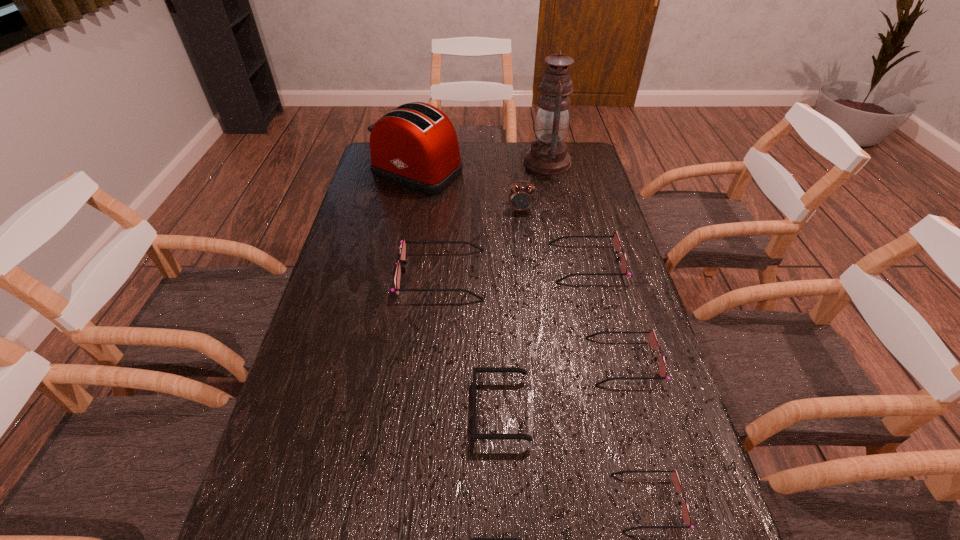
The height and width of the screenshot is (540, 960). I want to click on blank space located on the bridge of the fifth shortest sunglasses, so tap(529, 262).

Locate an element on the screen. This screenshot has height=540, width=960. free region located 0.390m on the bridge of the second nearest pink sunglasses is located at coordinates (430, 361).

Identify the location of vacant space positioned on the bridge of the second nearest pink sunglasses. The height and width of the screenshot is (540, 960). (529, 361).

Identify the location of vacant area situated on the bridge of the second nearest pink sunglasses. (504, 361).

I want to click on vacant space situated 0.100m on the front-facing side of the bigger black sunglasses, so 428,410.

Where is `free space located 0.070m on the front-facing side of the bigger black sunglasses`? The image size is (960, 540). free space located 0.070m on the front-facing side of the bigger black sunglasses is located at coordinates [x=442, y=410].

Where is `vacant space situated on the front-facing side of the bigger black sunglasses`? Image resolution: width=960 pixels, height=540 pixels. vacant space situated on the front-facing side of the bigger black sunglasses is located at coordinates (415, 410).

The image size is (960, 540). I want to click on vacant space positioned 0.050m on the bridge of the nearest pink sunglasses, so click(590, 502).

At what (x,y) coordinates should I click in order to perform the action: click on blank space located 0.310m on the bridge of the nearest pink sunglasses. Please return your answer as a coordinate pair (x, y). The height and width of the screenshot is (540, 960). Looking at the image, I should click on (455, 502).

Find the location of a particular element. This screenshot has height=540, width=960. vacant space located on the bridge of the nearest pink sunglasses is located at coordinates (435, 502).